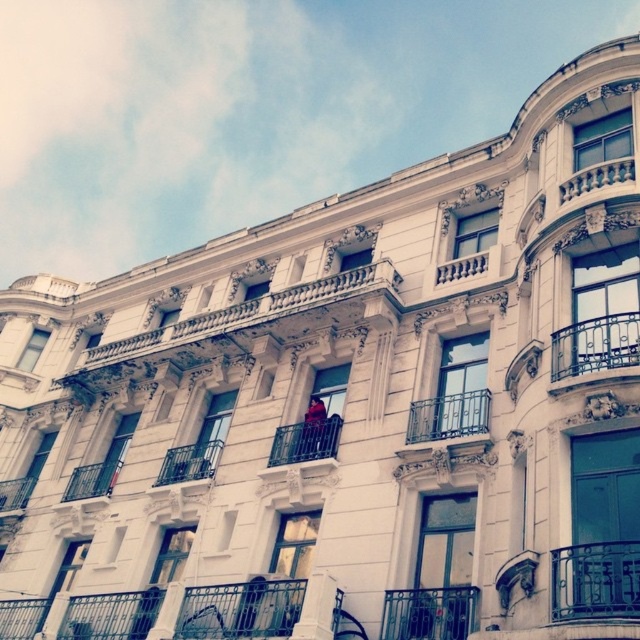
Question: Does dark gray metal balcony at lower right have a larger size compared to dark gray wrought iron balcony at upper right?

Choices:
 (A) yes
 (B) no

Answer: (A)

Question: Which object appears farthest from the camera in this image?

Choices:
 (A) dark gray metal balcony at lower right
 (B) metallic railing at center
 (C) red velvet jacket at center

Answer: (B)

Question: Which point is farther to the camera?

Choices:
 (A) metallic balcony at lower left
 (B) wrought iron balcony at center

Answer: (A)

Question: Which object is the closest to the red velvet jacket at center?

Choices:
 (A) dark gray wrought iron balcony at upper right
 (B) metallic railing at center
 (C) wrought iron balcony at center

Answer: (C)

Question: Is dark gray wrought iron balcony at upper right wider than red velvet jacket at center?

Choices:
 (A) no
 (B) yes

Answer: (B)

Question: Is dark gray metal balcony at lower right in front of metallic railing at center?

Choices:
 (A) no
 (B) yes

Answer: (B)